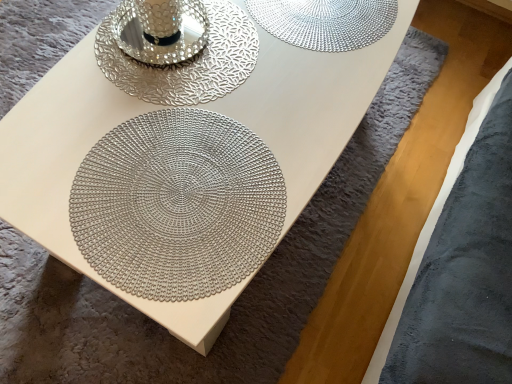
Identify the location of free location above metallic silver mandala at center (from a real-world perspective). (177, 180).